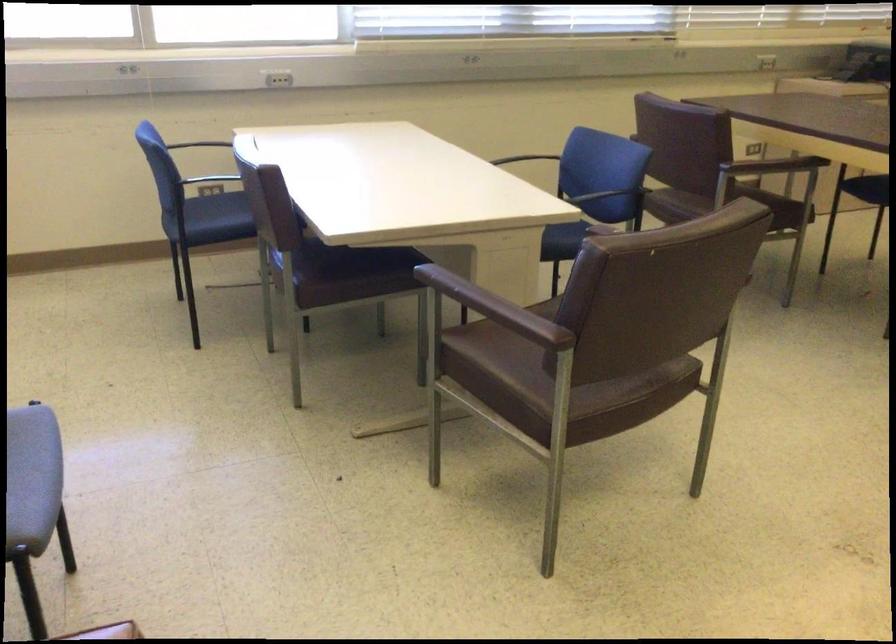
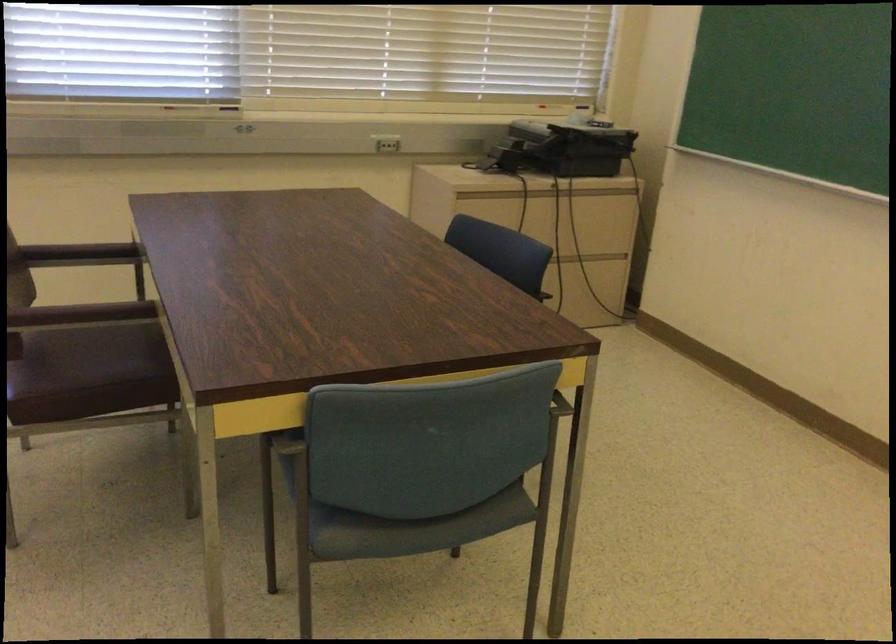
In a continuous first-person perspective shot, in which direction is the camera moving?

The cameraman moved toward right, forward.